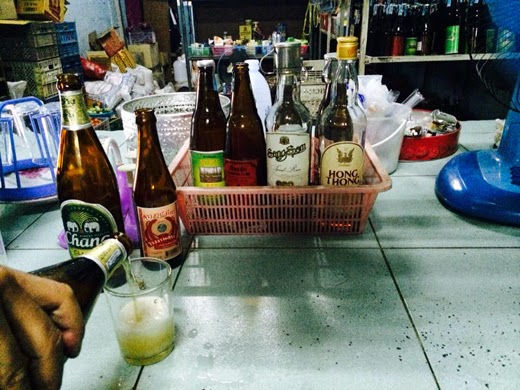
Image resolution: width=520 pixels, height=390 pixels. I want to click on tile floor, so click(x=339, y=346).